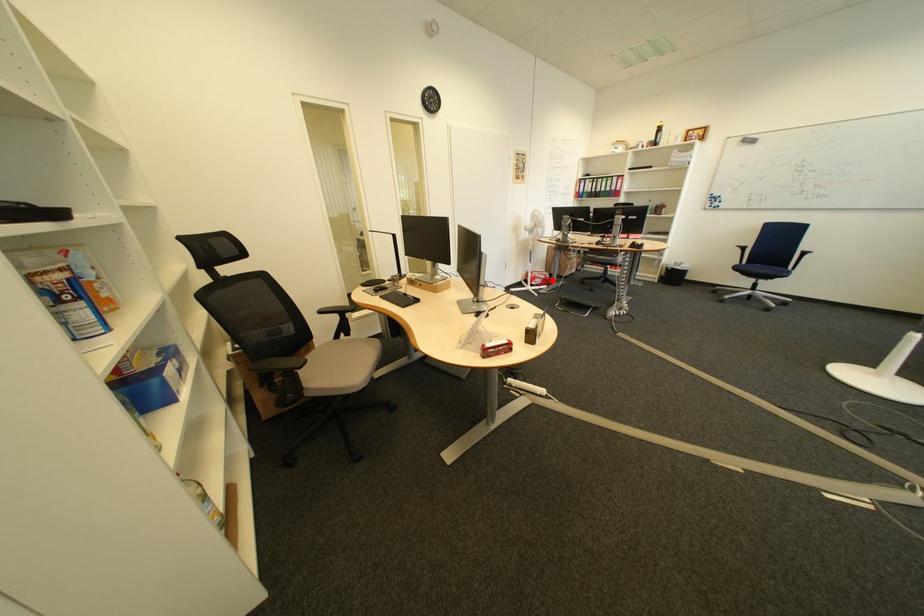
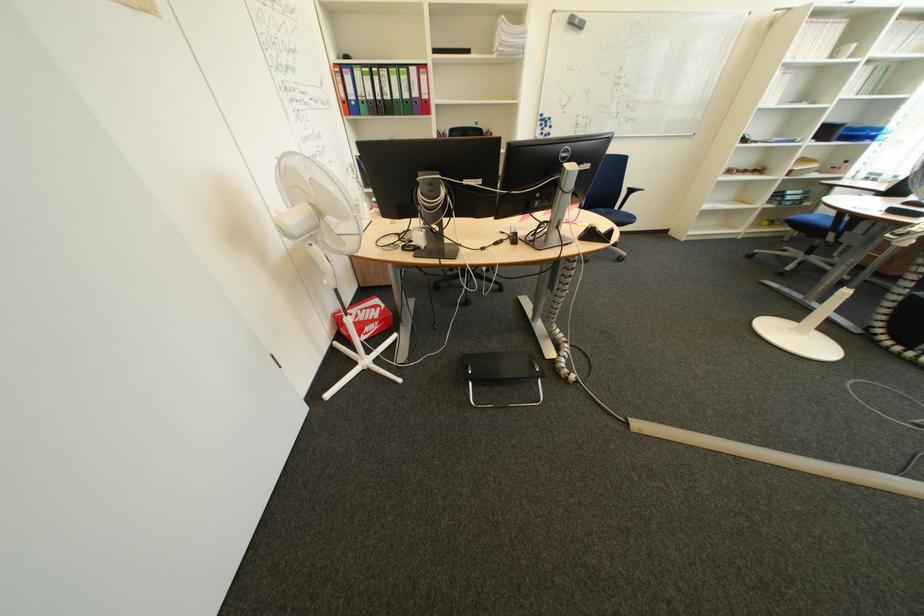
Question: I am providing you with two images of the same scene from different viewpoints. Given a red point in image1, look at the same physical point in image2. Is it:

Choices:
 (A) Closer to the viewpoint
 (B) Farther from the viewpoint

Answer: (B)